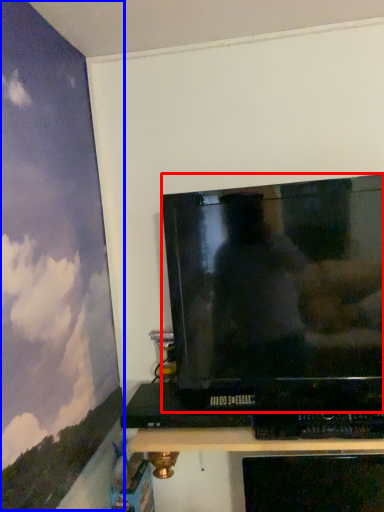
Question: Which object appears farthest to the camera in this image, television (highlighted by a red box) or backdrop (highlighted by a blue box)?

Choices:
 (A) television
 (B) backdrop

Answer: (A)